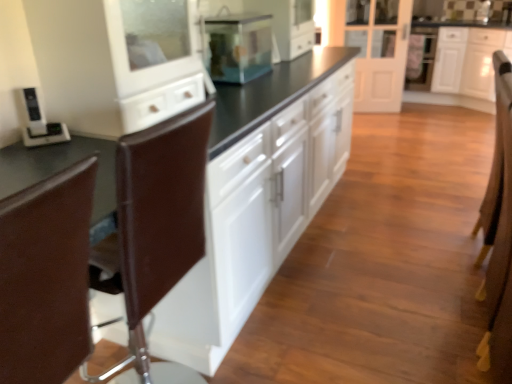
At what (x,y) coordinates should I click in order to perform the action: click on vacant space in front of black plastic phone at left. Please return your answer as a coordinate pair (x, y). Looking at the image, I should click on (36, 159).